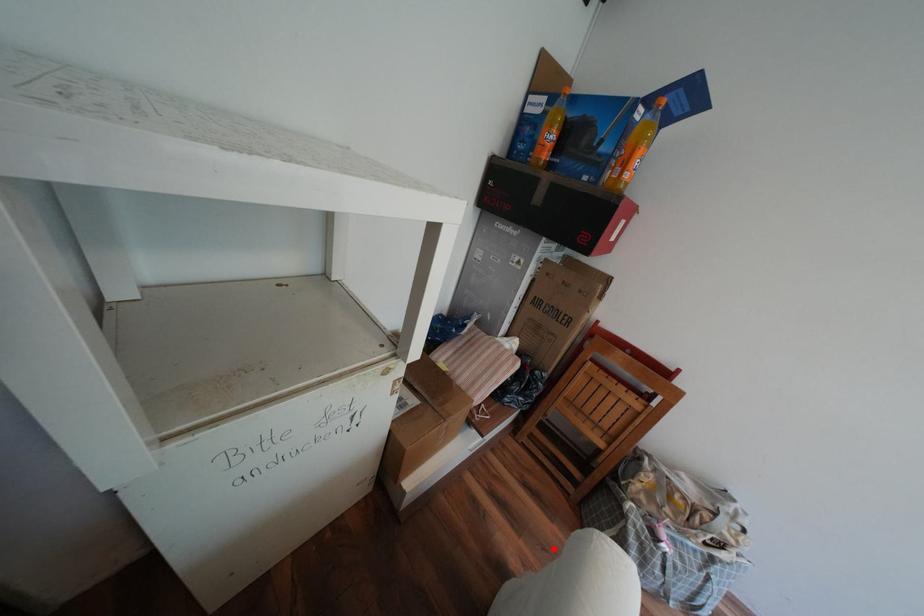
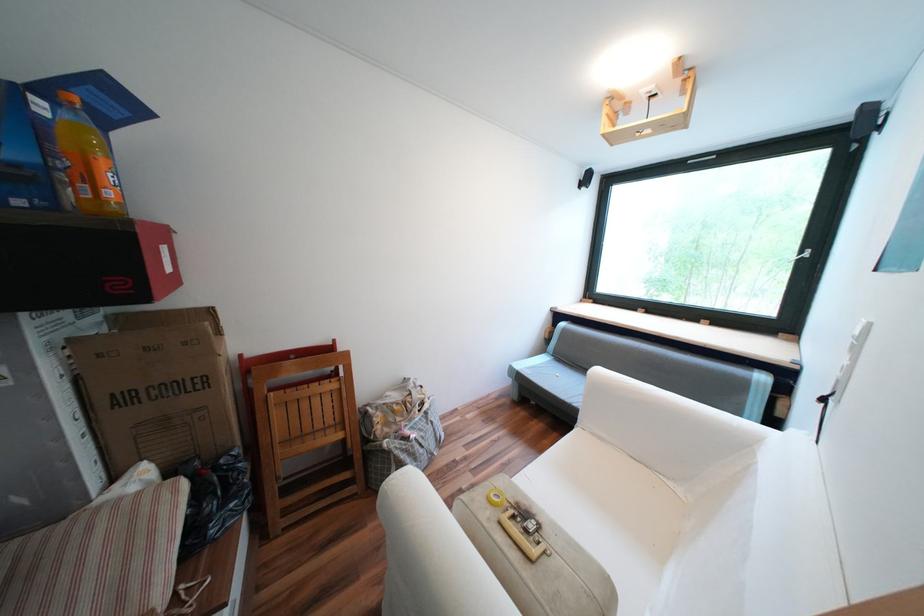
Find the pixel in the second image that matches the highlighted location in the first image.

(387, 548)